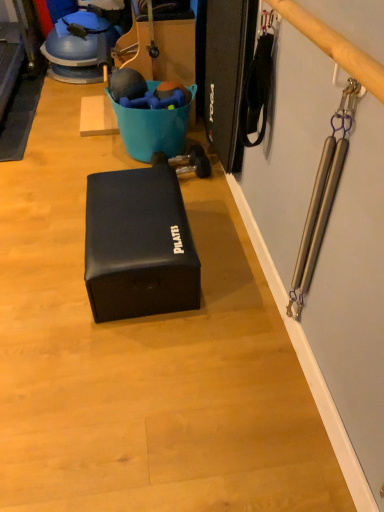
Question: From the image's perspective, is dark blue rubber yoga mat at left located above or below black leather box at center?

Choices:
 (A) above
 (B) below

Answer: (A)

Question: From a real-world perspective, is dark blue rubber yoga mat at left physically located above or below black leather box at center?

Choices:
 (A) below
 (B) above

Answer: (A)

Question: Considering their positions, is dark blue rubber yoga mat at left located in front of or behind black leather box at center?

Choices:
 (A) front
 (B) behind

Answer: (B)

Question: Does point (175, 193) appear closer or farther from the camera than point (33, 83)?

Choices:
 (A) closer
 (B) farther

Answer: (A)

Question: Is black leather box at center taller or shorter than dark blue rubber yoga mat at left?

Choices:
 (A) tall
 (B) short

Answer: (A)

Question: Based on their positions, is black leather box at center located to the left or right of dark blue rubber yoga mat at left?

Choices:
 (A) left
 (B) right

Answer: (B)

Question: From a real-world perspective, relative to dark blue rubber yoga mat at left, is black leather box at center vertically above or below?

Choices:
 (A) below
 (B) above

Answer: (B)